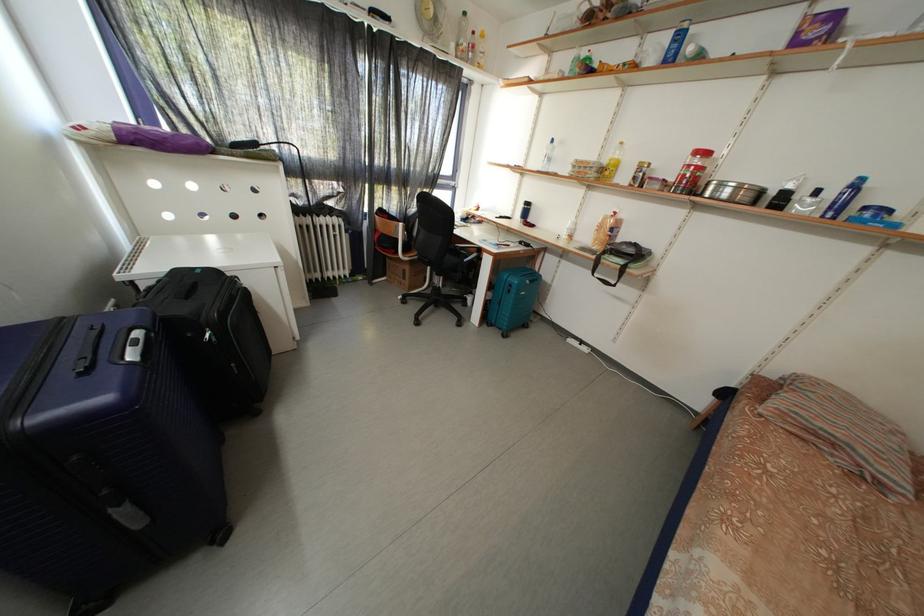
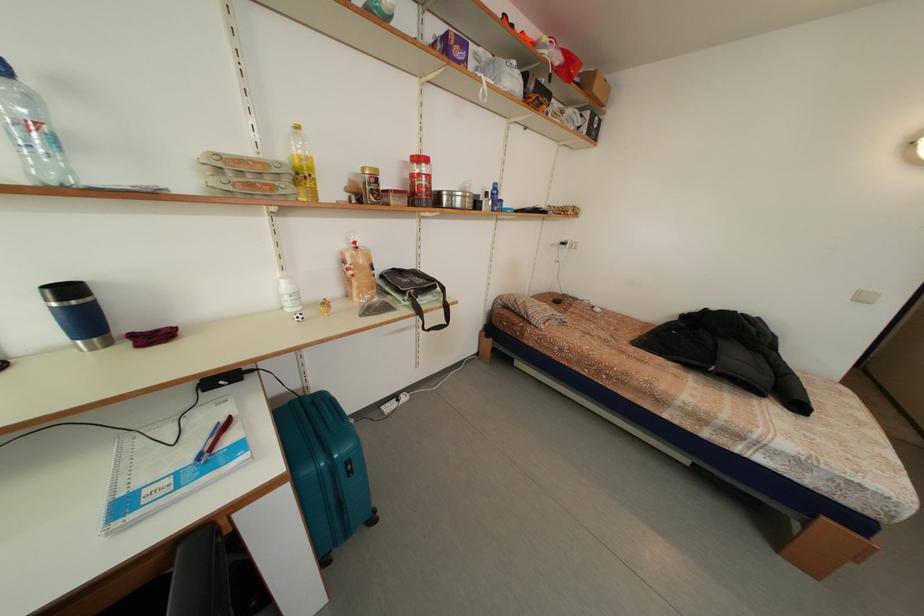
Find the pixel in the second image that matches (x=623, y=217) in the first image.

(362, 248)